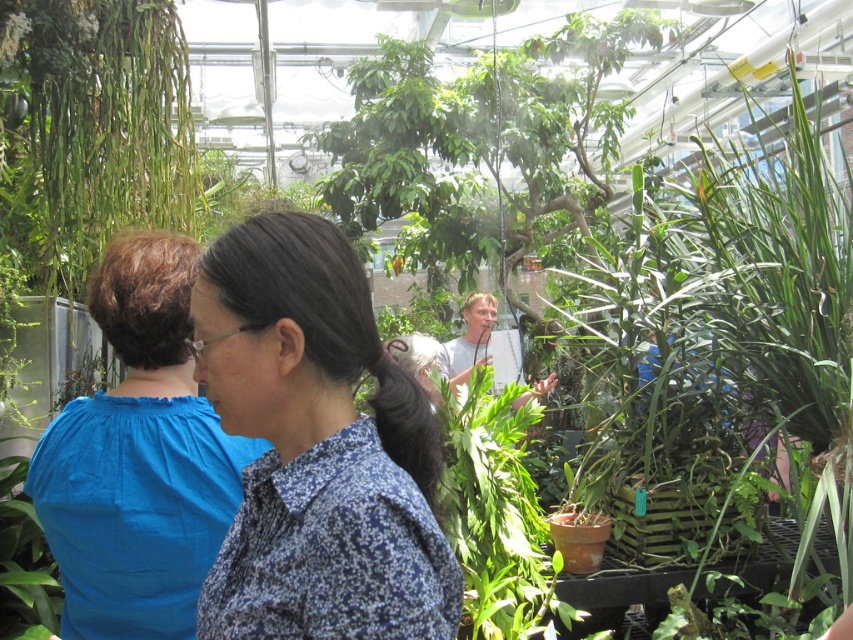
What is located at the coordinate point (316,449) in the image?

The blue printed shirt at center is located at point (316,449).

You are a visitor in the greenhouse and want to take a photo of both the blue printed shirt at center and the blue cotton blouse at left. Which one should you adjust your camera angle to capture first if you want to include both in the frame?

You should adjust your camera angle to capture the blue cotton blouse at left first since it is positioned to the left of the blue printed shirt at center, allowing you to frame both by panning from left to right.

You are standing in the greenhouse and want to locate the blue cotton blouse at left. According to the coordinates provided, where should you look relative to the center of the image?

The blue cotton blouse at left is located at coordinates approximately 0.717 on the x axis and 0.163 on the y axis, which places it to the right and slightly below the center of the image.